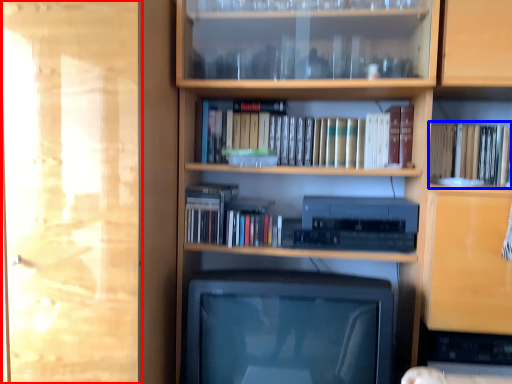
Question: Which point is further to the camera, glass door (highlighted by a red box) or book (highlighted by a blue box)?

Choices:
 (A) glass door
 (B) book

Answer: (B)